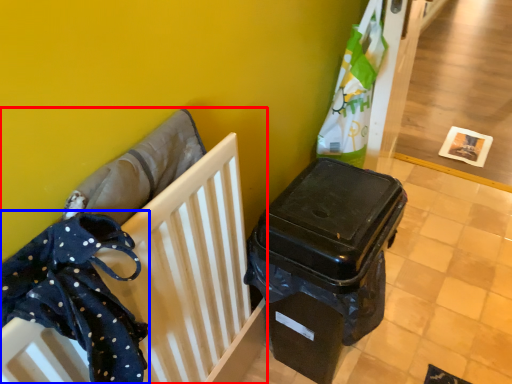
Question: Which of the following is the closest to the observer, furniture (highlighted by a red box) or clothe (highlighted by a blue box)?

Choices:
 (A) furniture
 (B) clothe

Answer: (B)